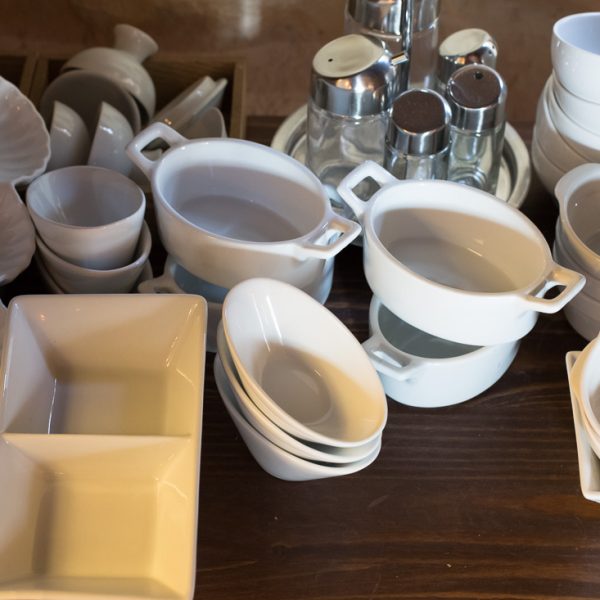
You are a GUI agent. You are given a task and a screenshot of the screen. Output one action in this format:
    pyautogui.click(x=<x>, y=<y>)
    Task: Click on the clear jars
    The image size is (600, 600).
    Given the screenshot: What is the action you would take?
    pyautogui.click(x=343, y=132), pyautogui.click(x=403, y=165), pyautogui.click(x=475, y=162), pyautogui.click(x=438, y=85), pyautogui.click(x=418, y=66)